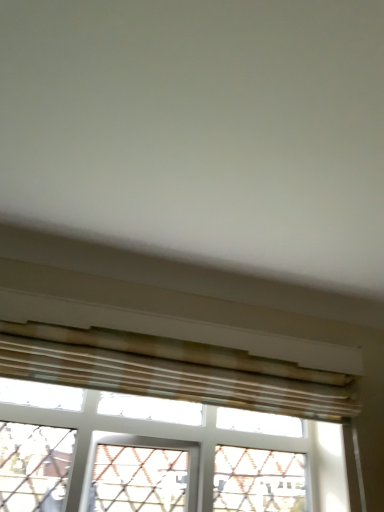
This screenshot has height=512, width=384. Identify the location of translucent glass window at center. (162, 434).

What is the approximate height of translucent glass window at center?

19.21 inches.

The height and width of the screenshot is (512, 384). Describe the element at coordinates (162, 434) in the screenshot. I see `translucent glass window at center` at that location.

You are a GUI agent. You are given a task and a screenshot of the screen. Output one action in this format:
    pyautogui.click(x=<x>, y=<y>)
    Task: Click on the translucent glass window at center
    
    Given the screenshot: What is the action you would take?
    pyautogui.click(x=162, y=434)